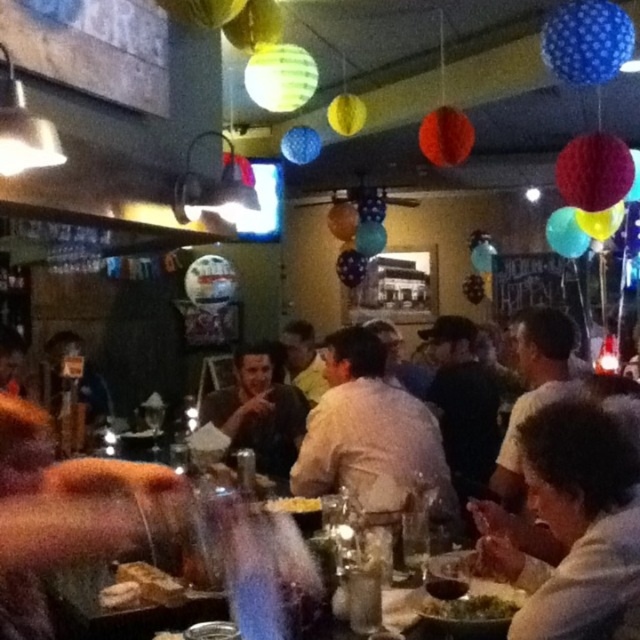
Question: Is white cotton shirt at center to the right of dark brown leather jacket at center from the viewer's perspective?

Choices:
 (A) no
 (B) yes

Answer: (B)

Question: Does white cotton shirt at center have a larger size compared to green leafy salad at center?

Choices:
 (A) no
 (B) yes

Answer: (B)

Question: Which point is farther to the camera?

Choices:
 (A) white cotton shirt at center
 (B) white matte shirt at lower right
 (C) dark brown leather jacket at center
 (D) green leafy salad at center

Answer: (C)

Question: Does white cotton shirt at center have a smaller size compared to green leafy salad at center?

Choices:
 (A) yes
 (B) no

Answer: (B)

Question: Which of these objects is positioned farthest from the dark brown leather jacket at center?

Choices:
 (A) white matte shirt at lower right
 (B) green leafy salad at center
 (C) white cotton shirt at center

Answer: (B)

Question: Which point is closer to the camera taking this photo?

Choices:
 (A) (349, 460)
 (B) (554, 531)
 (C) (509, 605)

Answer: (B)